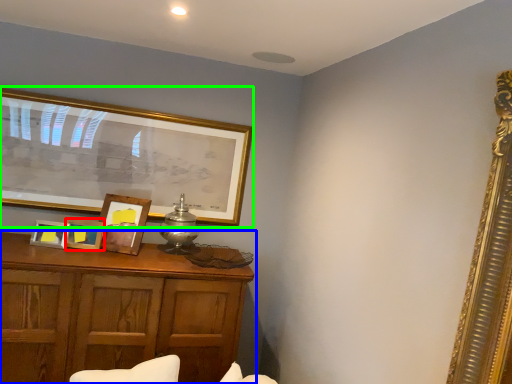
Question: Considering the real-world distances, which object is farthest from picture frame (highlighted by a red box)? table (highlighted by a blue box) or picture frame (highlighted by a green box)?

Choices:
 (A) table
 (B) picture frame

Answer: (B)